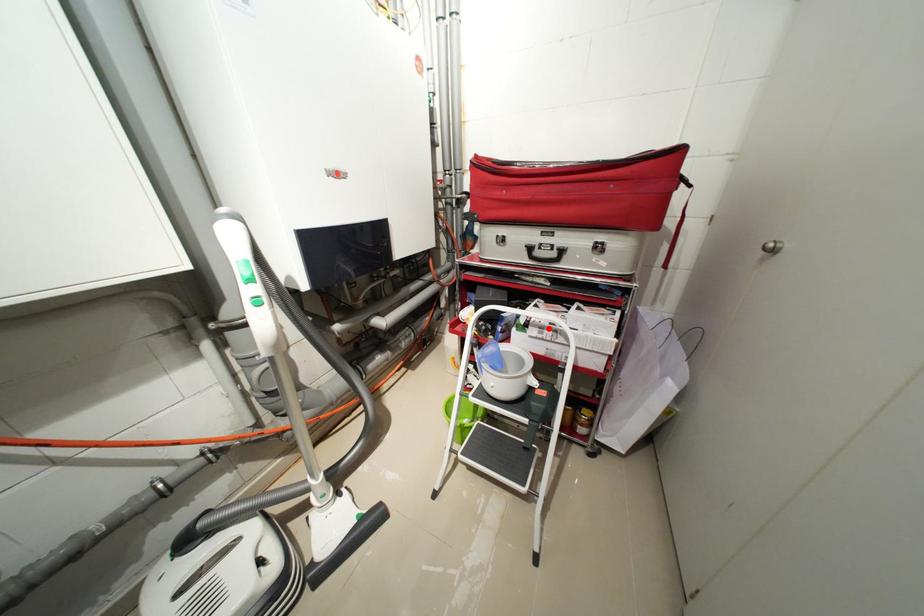
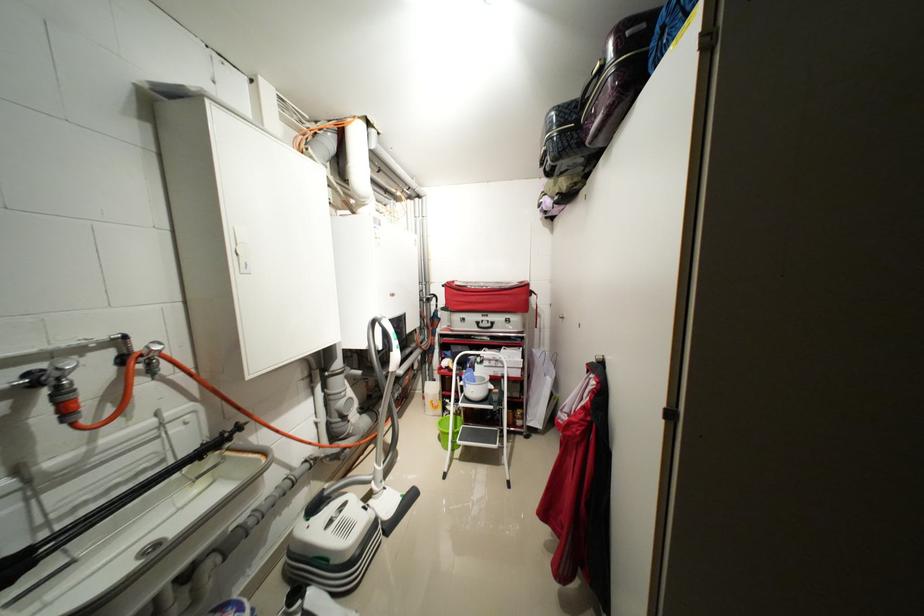
The point at the highlighted location is marked in the first image. Where is the corresponding point in the second image?

(496, 361)